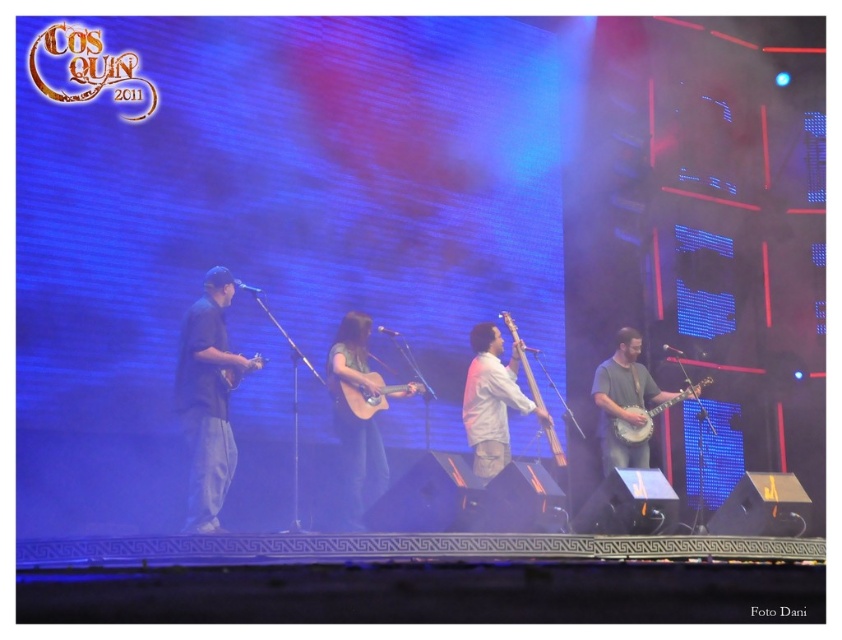
Question: Is light brown acoustic guitar at center to the left of matte wood guitar at center from the viewer's perspective?

Choices:
 (A) no
 (B) yes

Answer: (B)

Question: Among these objects, which one is nearest to the camera?

Choices:
 (A) white matte cello at center
 (B) matte acoustic guitar at center
 (C) matte brown banjo at center
 (D) light brown acoustic guitar at center

Answer: (B)

Question: Can you confirm if matte brown banjo at center is bigger than wooden acoustic guitar at center?

Choices:
 (A) yes
 (B) no

Answer: (A)

Question: Is matte acoustic guitar at center behind matte brown banjo at center?

Choices:
 (A) no
 (B) yes

Answer: (A)

Question: Which point is farther to the camera?

Choices:
 (A) (488, 397)
 (B) (217, 273)
 (C) (626, 435)
 (D) (523, 346)

Answer: (C)

Question: Which object appears farthest from the camera in this image?

Choices:
 (A) wooden acoustic guitar at center
 (B) matte brown banjo at center
 (C) matte brown banjo at right
 (D) dark gray fabric guitar at left

Answer: (C)